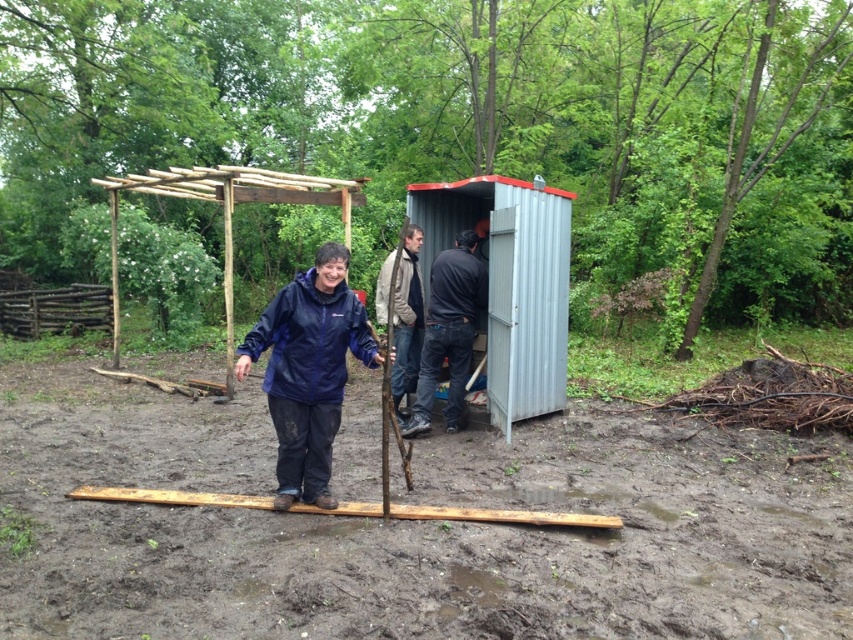
You are a hiker who has just arrived at this wooded area and see the navy blue jacket at center and the natural wood pergola at center. Which object is closer to you?

The navy blue jacket at center is closer to you because it is in front of the natural wood pergola at center.

You are a hiker who needs to choose between the navy blue jacket at center and the light brown leather jacket at center. Which jacket is wider?

The navy blue jacket at center is wider than the light brown leather jacket at center according to their widths.

You are a delivery person carrying a package that requires a minimum of 2 meters of space to safely place it between the navy blue jacket at center and the light brown leather jacket at center. Can you fit the package between them?

The distance between the navy blue jacket at center and the light brown leather jacket at center is 2.34 meters, which is more than the required 2 meters. Therefore, the package can be safely placed between them.